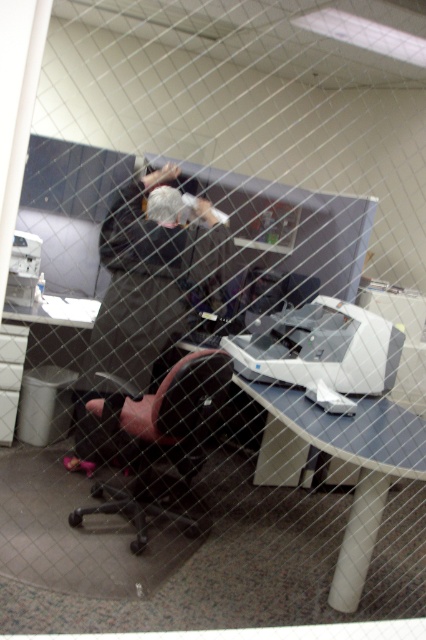
You are a delivery person who needs to place a package on the desk in the office scene. The package is 1 meter tall. Considering the dark gray coat at center and the black leather swivel chair at center, will the package fit on the desk without blocking either of them?

The dark gray coat at center is much taller than the black leather swivel chair at center. Since the package is 1 meter tall, it would be taller than both objects, potentially blocking them if placed on the desk.

You are standing in front of the office scene. There are two points marked in the image. The first point is at coordinates point (169, 259) and the second point is at point (279, 445). Which point is closer to you?

Point (169, 259) is closer to the viewer than point (279, 445).